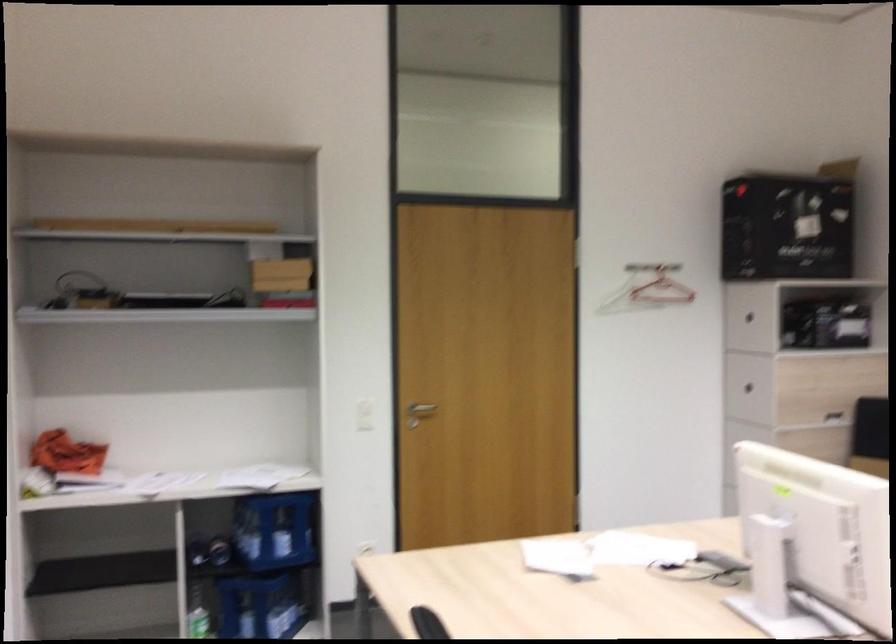
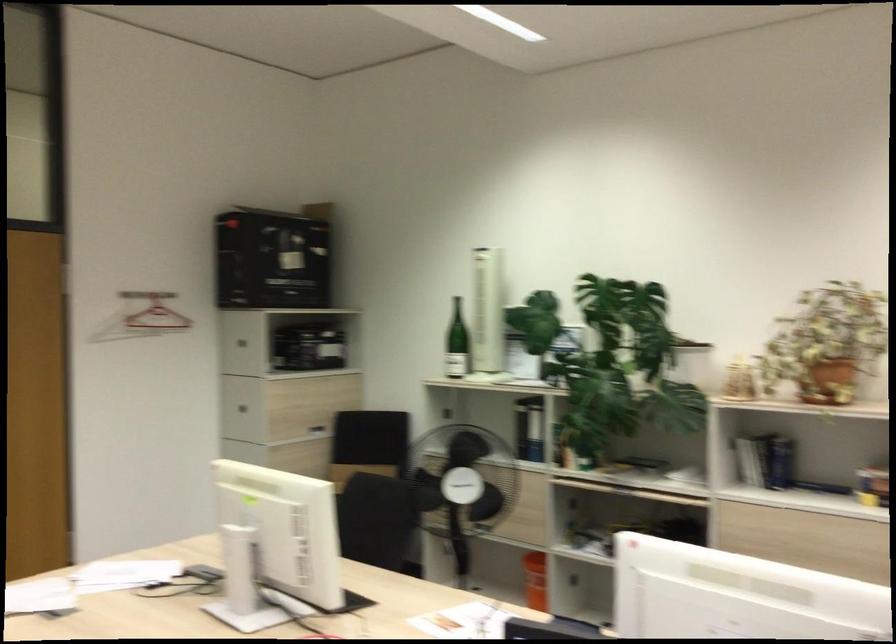
Locate, in the second image, the point that corresponds to point 752,384 in the first image.

(244, 402)